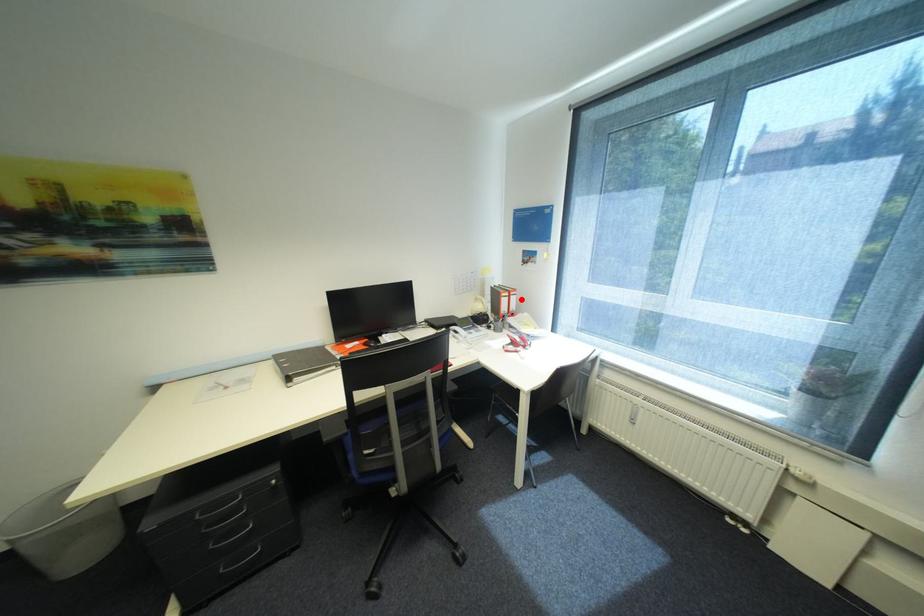
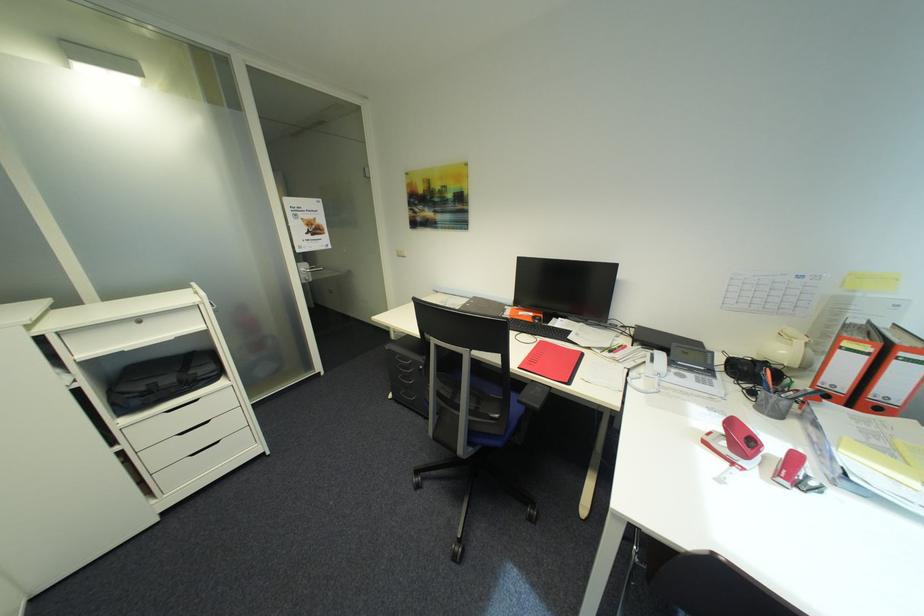
In the second image, find the point that corresponds to the highlighted location in the first image.

(912, 371)